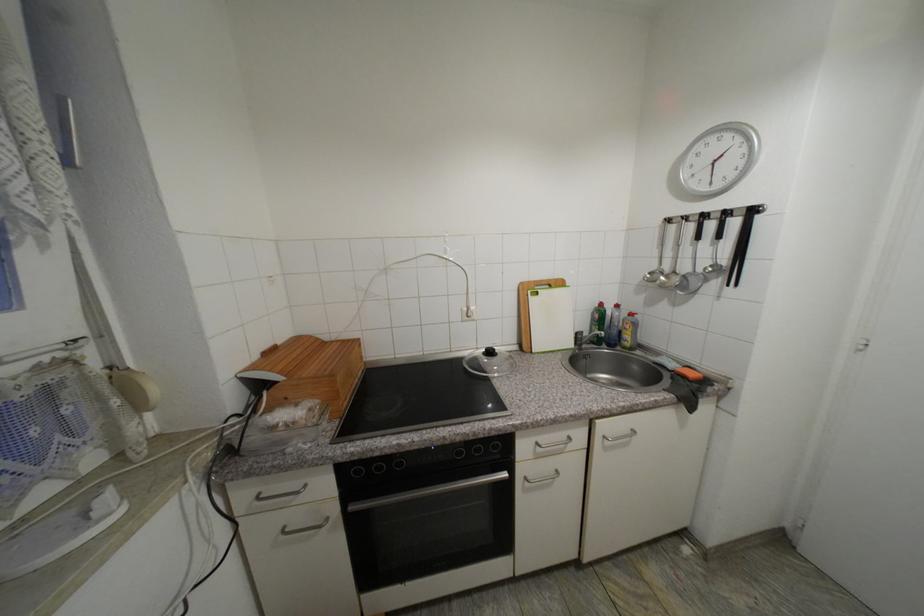
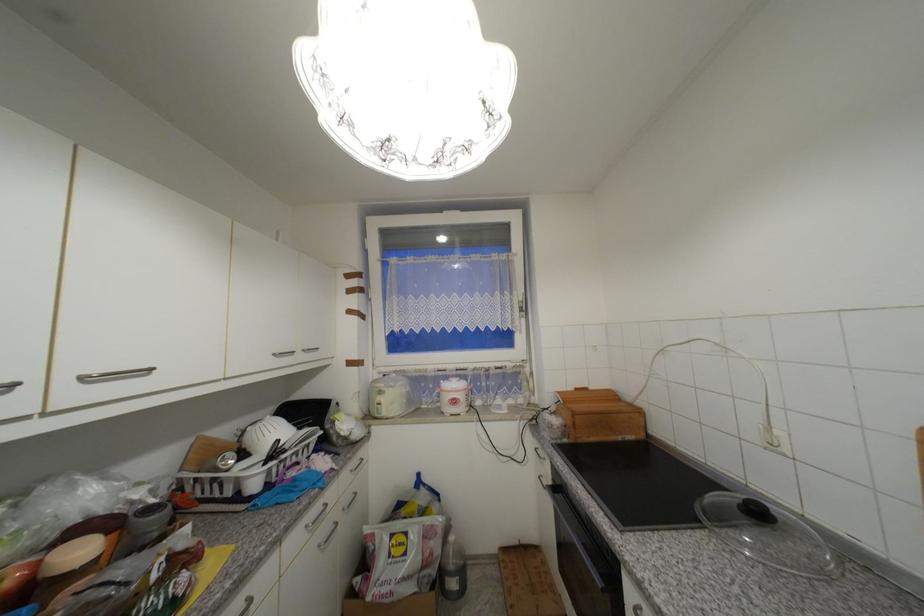
The point at (261,358) is marked in the first image. Where is the corresponding point in the second image?

(576, 390)